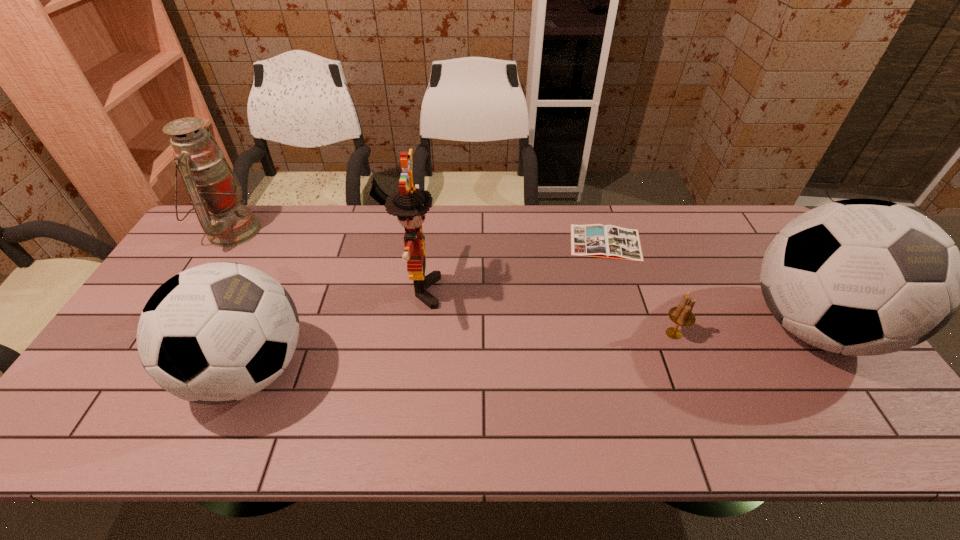
The image size is (960, 540). I want to click on vacant space situated 0.130m on the front-facing side of the nutcracker, so click(485, 291).

The height and width of the screenshot is (540, 960). In order to click on free region located 0.260m on the right of the book in this screenshot , I will do `click(722, 242)`.

Where is `vacant space situated on the left of the candle holder`? The image size is (960, 540). vacant space situated on the left of the candle holder is located at coordinates (556, 334).

You are a GUI agent. You are given a task and a screenshot of the screen. Output one action in this format:
    pyautogui.click(x=<x>, y=<y>)
    Task: Click on the oil lamp that is at the far edge
    Image resolution: width=960 pixels, height=540 pixels.
    Given the screenshot: What is the action you would take?
    pyautogui.click(x=215, y=192)

At what (x,y) coordinates should I click in order to perform the action: click on book positioned at the far edge. Please return your answer as a coordinate pair (x, y). Image resolution: width=960 pixels, height=540 pixels. Looking at the image, I should click on (595, 240).

Image resolution: width=960 pixels, height=540 pixels. In order to click on object present at the left edge in this screenshot , I will do `click(215, 192)`.

Identify the location of object that is positioned at the right edge. This screenshot has height=540, width=960. (861, 277).

The width and height of the screenshot is (960, 540). I want to click on object at the far left corner, so click(215, 192).

The width and height of the screenshot is (960, 540). In order to click on object that is at the near right corner in this screenshot , I will do `click(861, 277)`.

Where is `vacant space at the far edge of the desktop`? vacant space at the far edge of the desktop is located at coordinates (300, 242).